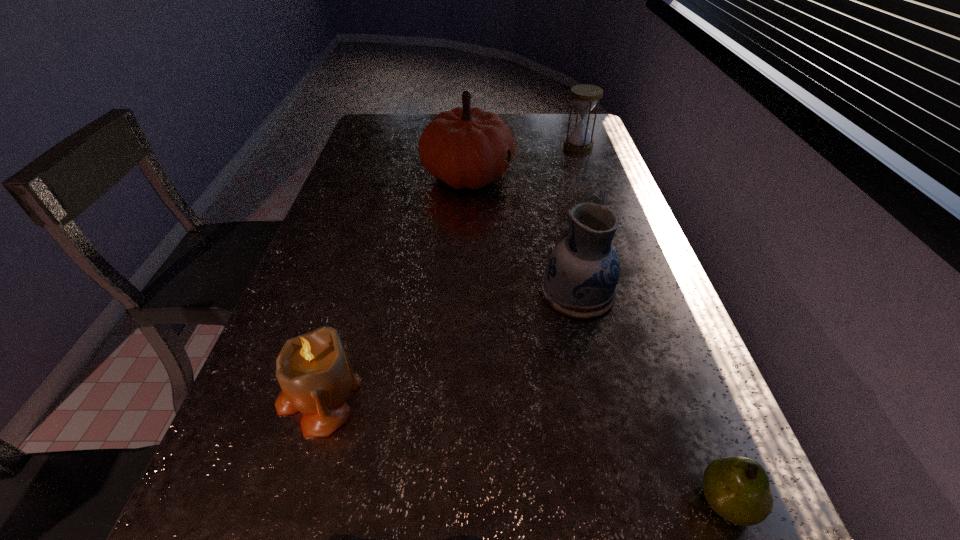
You are a GUI agent. You are given a task and a screenshot of the screen. Output one action in this format:
    pyautogui.click(x=<x>, y=<y>)
    Task: Click on the object that stands as the closest to the third nearest object
    
    Given the screenshot: What is the action you would take?
    click(340, 539)

Choose which object is the fifth nearest neighbor to the shortest object. Please provide its 2D coordinates. Your answer should be formatted as a tuple, i.e. [(x, y)], where the tuple contains the x and y coordinates of a point satisfying the conditions above.

[(585, 96)]

Where is `free point that satisfies the following two spatial constraints: 1. on the front-facing side of the third farthest object; 2. on the right side of the pumpkin`? Image resolution: width=960 pixels, height=540 pixels. free point that satisfies the following two spatial constraints: 1. on the front-facing side of the third farthest object; 2. on the right side of the pumpkin is located at coordinates (464, 292).

Where is `free spot that satisfies the following two spatial constraints: 1. on the front-facing side of the pumpkin; 2. on the back side of the third farthest object`? Image resolution: width=960 pixels, height=540 pixels. free spot that satisfies the following two spatial constraints: 1. on the front-facing side of the pumpkin; 2. on the back side of the third farthest object is located at coordinates (464, 292).

This screenshot has height=540, width=960. In order to click on free location that satisfies the following two spatial constraints: 1. on the front-facing side of the pumpkin; 2. on the right side of the pear in this screenshot , I will do `click(455, 502)`.

Locate an element on the screen. The height and width of the screenshot is (540, 960). free location that satisfies the following two spatial constraints: 1. on the front-facing side of the pumpkin; 2. on the back side of the pear is located at coordinates (455, 502).

Where is `vacant space that satisfies the following two spatial constraints: 1. on the front-facing side of the pumpkin; 2. on the back side of the fourth nearest object`? vacant space that satisfies the following two spatial constraints: 1. on the front-facing side of the pumpkin; 2. on the back side of the fourth nearest object is located at coordinates (464, 292).